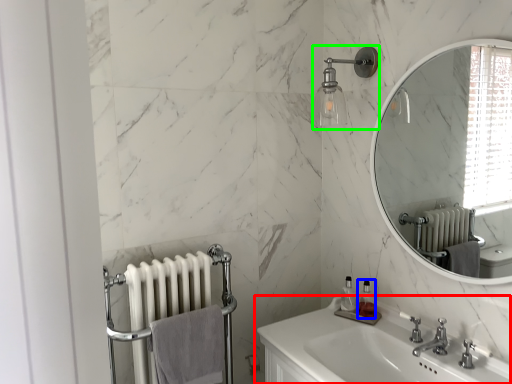
Question: Which is farther away from sink (highlighted by a red box)? soap dispenser (highlighted by a blue box) or shower (highlighted by a green box)?

Choices:
 (A) soap dispenser
 (B) shower

Answer: (B)